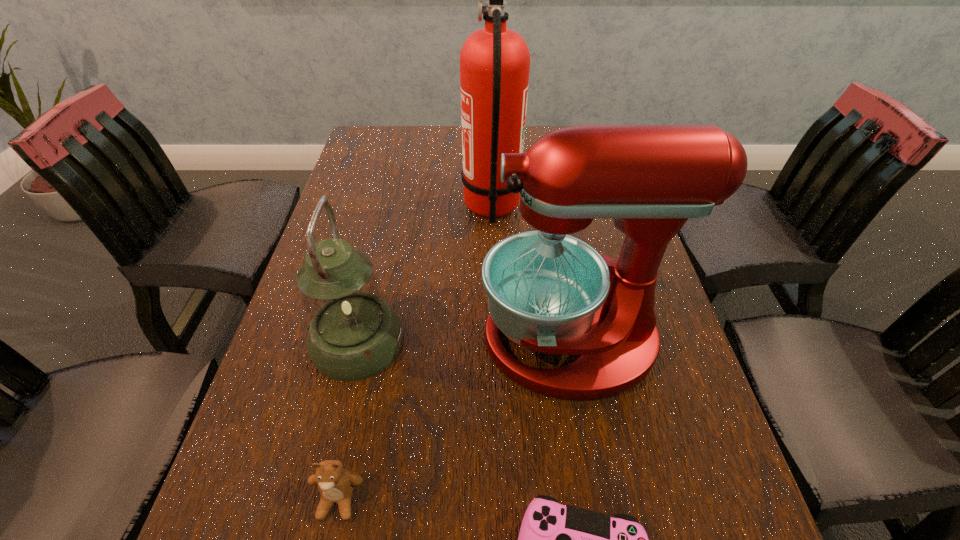
Locate an element on the screen. vacant area that satisfies the following two spatial constraints: 1. on the handle side of the fire extinguisher; 2. on the front-facing side of the teddy bear is located at coordinates (500, 500).